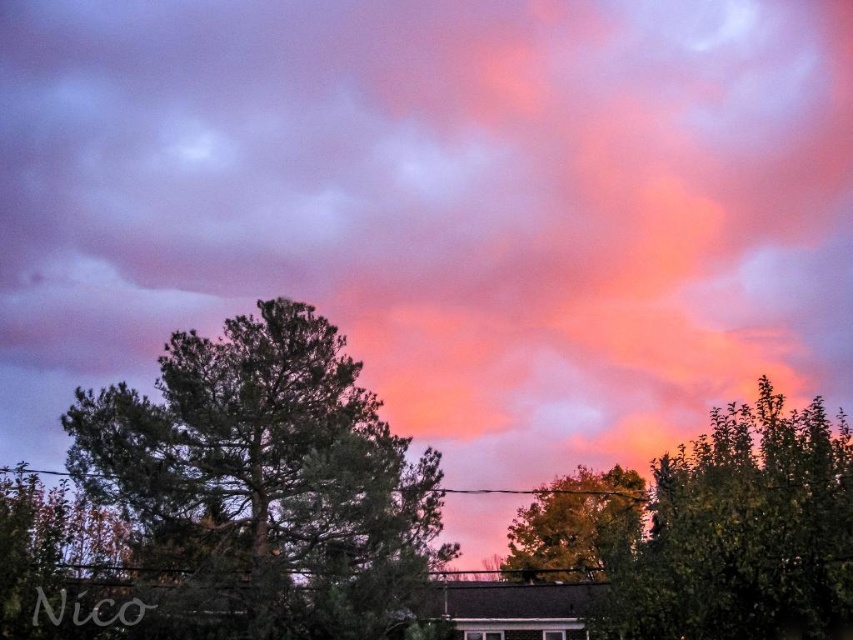
Question: Which object appears farthest from the camera in this image?

Choices:
 (A) green needle-like at center
 (B) green leafy tree at center

Answer: (B)

Question: Which of the following is the closest to the observer?

Choices:
 (A) (846, 452)
 (B) (154, 528)
 (C) (589, 577)

Answer: (A)

Question: In this image, where is green needle-like at center located relative to green leafy tree at center?

Choices:
 (A) right
 (B) left

Answer: (B)

Question: Is green needle-like at center thinner than green leafy tree at center?

Choices:
 (A) yes
 (B) no

Answer: (B)

Question: Considering the real-world distances, which object is farthest from the green needle-like at center?

Choices:
 (A) green leafy tree at upper center
 (B) green leafy tree at center

Answer: (B)

Question: Can you confirm if green needle-like at center is positioned above green leafy tree at upper center?

Choices:
 (A) no
 (B) yes

Answer: (B)